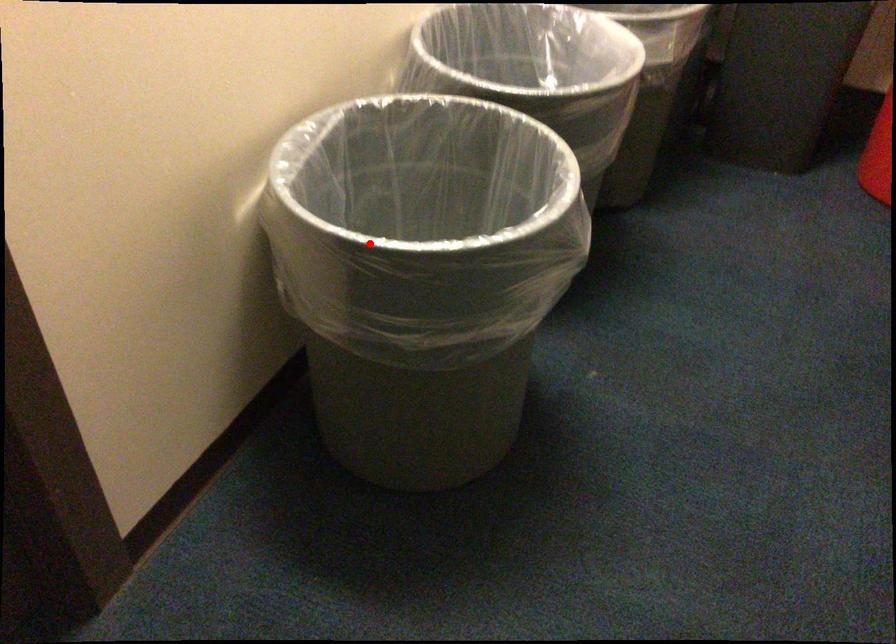
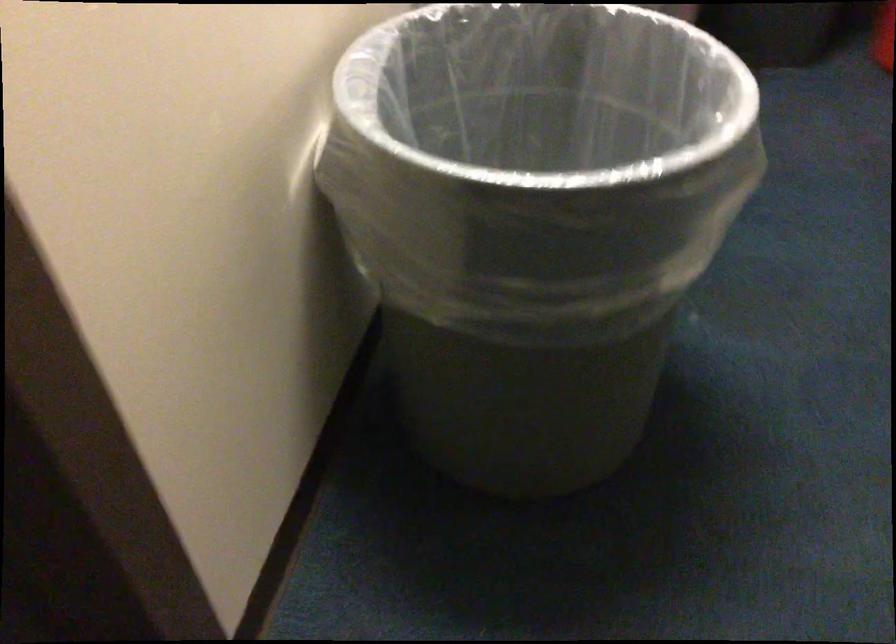
Question: I am providing you with two images of the same scene from different viewpoints. A red point is shown in image1. For the corresponding object point in image2, is it positioned nearer or farther from the camera?

Choices:
 (A) Nearer
 (B) Farther

Answer: (A)